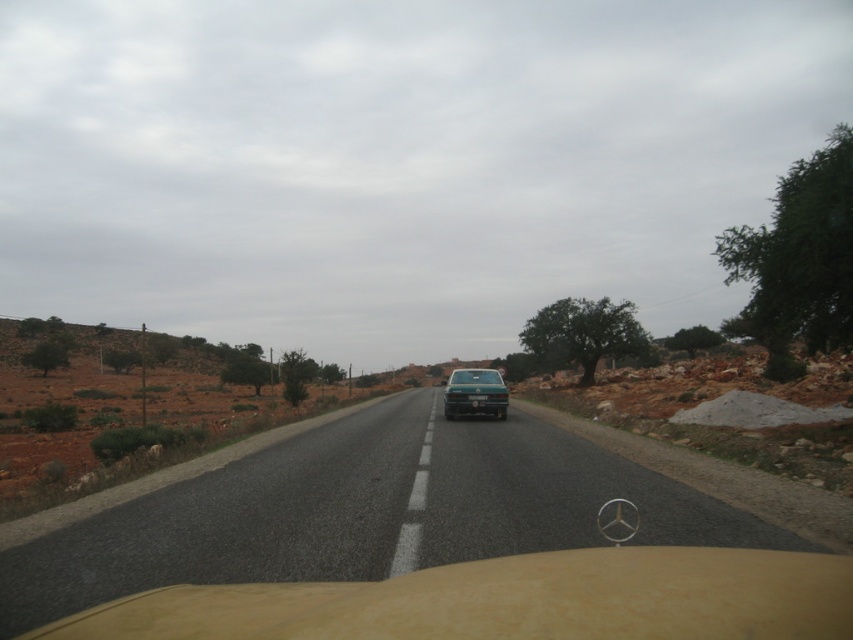
Question: Can you confirm if asphalt road at center is bigger than green matte car at center?

Choices:
 (A) yes
 (B) no

Answer: (A)

Question: Can you confirm if asphalt road at center is wider than green matte car at center?

Choices:
 (A) no
 (B) yes

Answer: (B)

Question: Does asphalt road at center appear under green matte car at center?

Choices:
 (A) no
 (B) yes

Answer: (B)

Question: Which point is closer to the camera?

Choices:
 (A) (466, 380)
 (B) (305, 598)

Answer: (B)

Question: Which point is farther to the camera?

Choices:
 (A) (479, 392)
 (B) (59, 560)

Answer: (A)